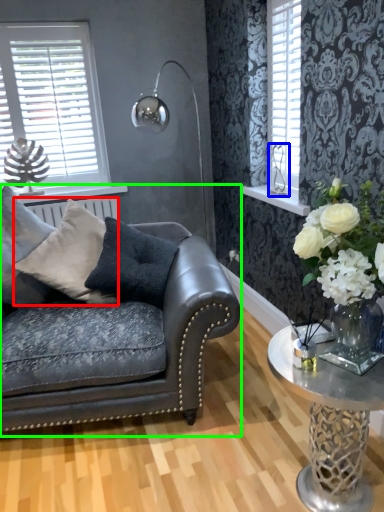
Question: Which object is the closest to the pillow (highlighted by a red box)? Choose among these: silver (highlighted by a blue box) or studio couch (highlighted by a green box).

Choices:
 (A) silver
 (B) studio couch

Answer: (B)